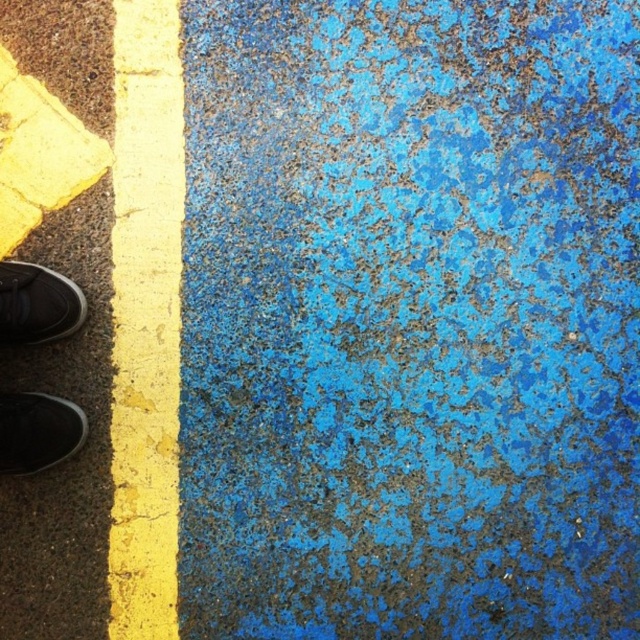
You are a delivery person trying to park your bike on this pavement. The yellow painted line at left marks the boundary between two zones. Your bike has to be entirely within the zone where the black suede shoe at lower left is not. Where should you park your bike?

The yellow painted line at left is located below the black suede shoe at lower left, so the black suede shoe is in the zone above the line. To park the bike entirely in the zone without the shoe, you should position it on the side of the yellow painted line at left opposite to the black suede shoe at lower left, which would be the lower area below the line.

You are a delivery person standing on the pavement. You notice the yellow painted line at left and the matte black shoe at lower left. Which object is taller when viewed from above?

The yellow painted line at left is taller than the matte black shoe at lower left according to the description.

You are a delivery person trying to avoid stepping on the blue painted area. You see the matte black shoe at lower left and the black suede shoe at lower left. Which shoe is closer to the yellow line that separates the blue area?

The matte black shoe at lower left is positioned on the right side of black suede shoe at lower left. Since the yellow line is between the two pavement sections, the black suede shoe at lower left is closer to the yellow line and thus closer to the blue painted area. To avoid stepping on the blue area, the delivery person should move toward the matte black shoe at lower left which is further from the blue section.